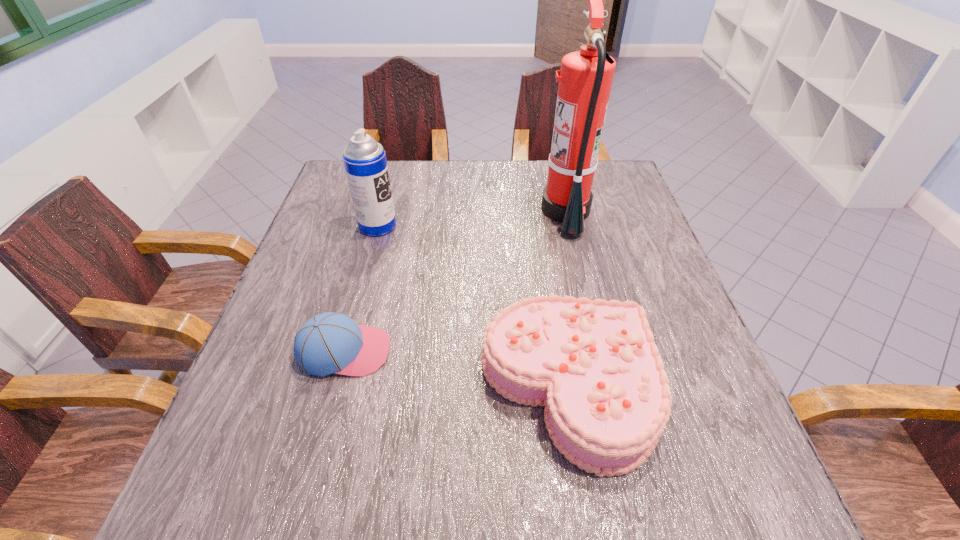
Where is `object located at the far edge`? object located at the far edge is located at coordinates (585, 79).

The width and height of the screenshot is (960, 540). In order to click on object present at the near edge in this screenshot , I will do pos(594,365).

Identify the location of aerosol can that is at the left edge. click(365, 163).

At what (x,y) coordinates should I click in order to perform the action: click on baseball cap situated at the left edge. Please return your answer as a coordinate pair (x, y). Looking at the image, I should click on (330, 342).

This screenshot has width=960, height=540. I want to click on fire extinguisher located at the right edge, so click(585, 79).

Locate an element on the screen. The image size is (960, 540). cake that is at the right edge is located at coordinates tap(594, 365).

In order to click on object located at the far right corner in this screenshot , I will do `click(585, 79)`.

Identify the location of object that is positioned at the near right corner. (594, 365).

This screenshot has height=540, width=960. I want to click on vacant space at the far edge of the desktop, so click(460, 168).

Image resolution: width=960 pixels, height=540 pixels. Identify the location of vacant space at the near edge of the desktop. (576, 515).